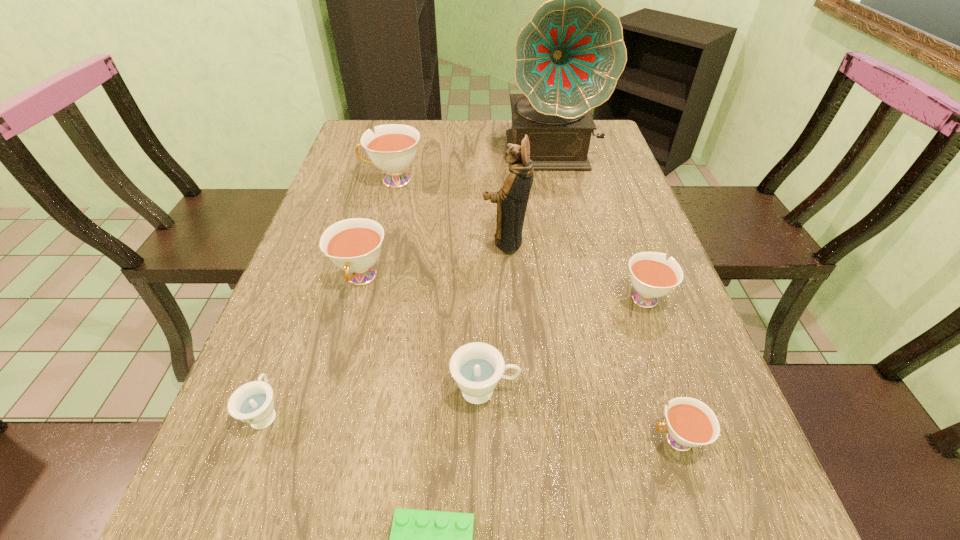
Image resolution: width=960 pixels, height=540 pixels. I want to click on the left blue teacup, so click(252, 403).

You are a GUI agent. You are given a task and a screenshot of the screen. Output one action in this format:
    pyautogui.click(x=<x>, y=<y>)
    Task: Click on the blank space located on the horn of the tallest object
    The height and width of the screenshot is (540, 960).
    Given the screenshot: What is the action you would take?
    pyautogui.click(x=562, y=194)

The image size is (960, 540). I want to click on free point located 0.400m on the front-facing side of the second tallest object, so click(318, 242).

At what (x,y) coordinates should I click in order to perform the action: click on vacant space located on the front-facing side of the second tallest object. Please return your answer as a coordinate pair (x, y). This screenshot has height=540, width=960. Looking at the image, I should click on (442, 242).

Locate an element on the screen. The image size is (960, 540). vacant space located on the front-facing side of the second tallest object is located at coordinates (318, 242).

At what (x,y) coordinates should I click in order to perform the action: click on free point located 0.060m on the side of the tallest teacup with the handle. Please return your answer as a coordinate pair (x, y). Looking at the image, I should click on (341, 180).

Image resolution: width=960 pixels, height=540 pixels. Find the location of `free space located on the side of the tallest teacup with the handle`. free space located on the side of the tallest teacup with the handle is located at coordinates (337, 180).

Locate an element on the screen. Image resolution: width=960 pixels, height=540 pixels. free space located on the side of the tallest teacup with the handle is located at coordinates (334, 180).

Where is `vacant region located on the side of the sixth shortest object with the handle`? vacant region located on the side of the sixth shortest object with the handle is located at coordinates (340, 359).

Where is `vacant space located 0.110m on the side of the third biggest white teacup with the handle`? vacant space located 0.110m on the side of the third biggest white teacup with the handle is located at coordinates (625, 245).